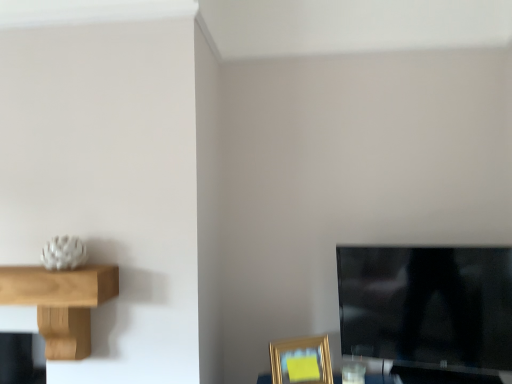
Question: Is black glossy tv at lower right facing away from gold metallic picture frame at lower right?

Choices:
 (A) yes
 (B) no

Answer: (B)

Question: From the image's perspective, is black glossy tv at lower right on top of gold metallic picture frame at lower right?

Choices:
 (A) yes
 (B) no

Answer: (A)

Question: Can gold metallic picture frame at lower right be found inside black glossy tv at lower right?

Choices:
 (A) yes
 (B) no

Answer: (B)

Question: Is there a large distance between black glossy tv at lower right and gold metallic picture frame at lower right?

Choices:
 (A) no
 (B) yes

Answer: (A)

Question: Is black glossy tv at lower right to the right of gold metallic picture frame at lower right from the viewer's perspective?

Choices:
 (A) no
 (B) yes

Answer: (B)

Question: Is black glossy tv at lower right at the left side of gold metallic picture frame at lower right?

Choices:
 (A) yes
 (B) no

Answer: (B)

Question: Considering the relative sizes of gold metallic picture frame at lower right and light brown wooden shelf at left in the image provided, is gold metallic picture frame at lower right smaller than light brown wooden shelf at left?

Choices:
 (A) no
 (B) yes

Answer: (B)

Question: Can you confirm if gold metallic picture frame at lower right is positioned to the right of light brown wooden shelf at left?

Choices:
 (A) yes
 (B) no

Answer: (A)

Question: Is gold metallic picture frame at lower right completely or partially outside of light brown wooden shelf at left?

Choices:
 (A) no
 (B) yes

Answer: (B)

Question: From a real-world perspective, is gold metallic picture frame at lower right beneath light brown wooden shelf at left?

Choices:
 (A) yes
 (B) no

Answer: (A)

Question: Is gold metallic picture frame at lower right far from light brown wooden shelf at left?

Choices:
 (A) no
 (B) yes

Answer: (A)

Question: From the image's perspective, is gold metallic picture frame at lower right beneath light brown wooden shelf at left?

Choices:
 (A) no
 (B) yes

Answer: (B)

Question: Does gold metallic picture frame at lower right touch black glossy tv at lower right?

Choices:
 (A) yes
 (B) no

Answer: (B)